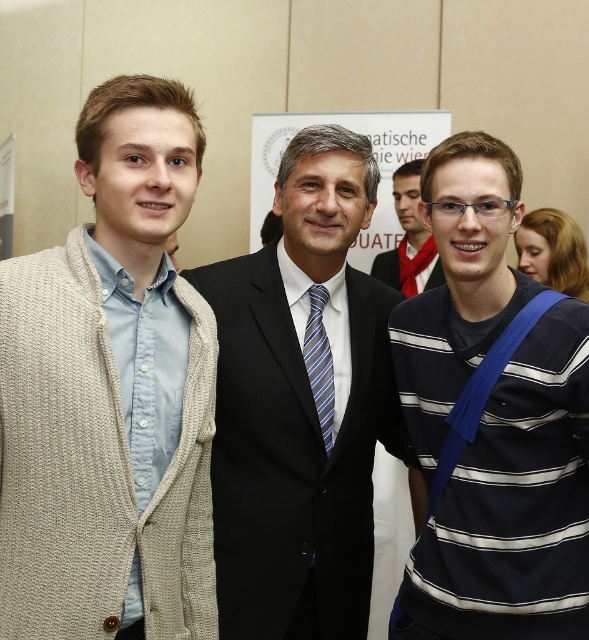
Question: Which point is closer to the camera?

Choices:
 (A) (72, 248)
 (B) (402, 240)
 (C) (441, 273)

Answer: (A)

Question: Is striped cotton sweater at center thinner than blue striped tie at center?

Choices:
 (A) no
 (B) yes

Answer: (A)

Question: Estimate the real-world distances between objects in this image. Which object is farther from the black suit at center?

Choices:
 (A) matte black suit at center
 (B) beige knitted cardigan at left
 (C) blue striped tie at center
 (D) dark blue textured suit at center

Answer: (D)

Question: Can you confirm if beige knitted cardigan at left is thinner than dark blue textured suit at center?

Choices:
 (A) yes
 (B) no

Answer: (B)

Question: Based on their relative distances, which object is farther from the matte black suit at center?

Choices:
 (A) dark blue textured suit at center
 (B) beige knitted cardigan at left
 (C) blue striped tie at center
 (D) black suit at center

Answer: (B)

Question: Does striped cotton sweater at center appear under black suit at center?

Choices:
 (A) no
 (B) yes

Answer: (B)